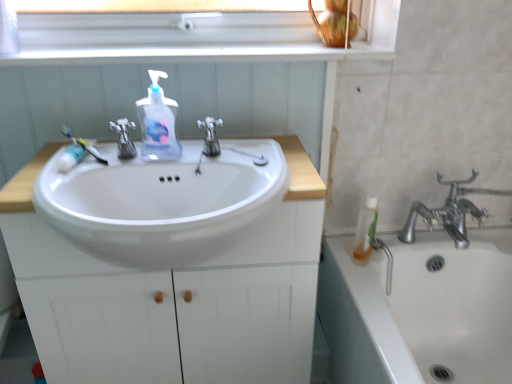
The image size is (512, 384). In order to click on free location in front of white plastic toothbrush at left in this screenshot , I will do `click(60, 179)`.